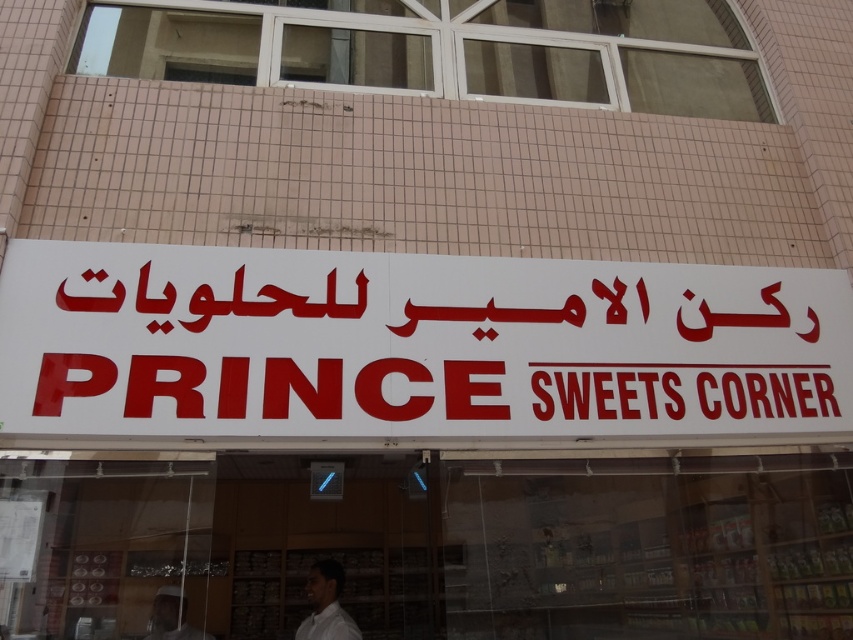
You are standing in front of the Prince Sweets Corner store. There are two points marked on the building facade. The first point is at coordinate point (x=469, y=552) and the second is at point (x=335, y=614). Which point is closer to the entrance of the store?

Point (x=335, y=614) is closer to the entrance because it is in front of point (x=469, y=552).

You are a customer entering the Prince Sweets Corner store. You see a transparent glass storefront at center and a white matte shirt at lower center. Which object is closer to you as you approach the entrance?

The transparent glass storefront at center is closer to you because the white matte shirt at lower center is behind it.

You are standing in front of the Prince Sweets Corner store. You see a white matte signboard at center and a white matte man at center. Which object is closer to you?

The white matte signboard at center is closer to you because it is in front of the white matte man at center.